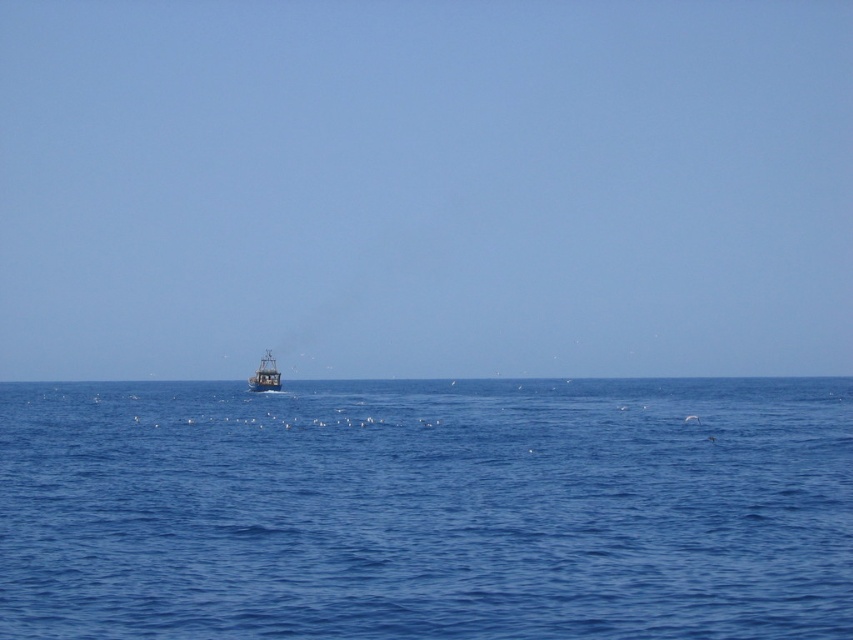
You are a sailor trying to navigate your boat to the nearest dock. You see the blue liquid water at center and the metallic gray boat at center. Which object is bigger and might help you determine your position relative to the dock?

The blue liquid water at center is larger in size than the metallic gray boat at center, so the larger blue liquid water at center might indicate the main body of water, helping you determine your position relative to the dock.

You are a drone operator trying to capture the fishing boat in the image. The boat is located at the left side of the frame. To ensure the boat is centered in your shot, you need to adjust your drone to the coordinates where the blue liquid water at center is located. What are the coordinates you should aim for?

The coordinates to aim for are point (x=427, y=509) where the blue liquid water at center is located.